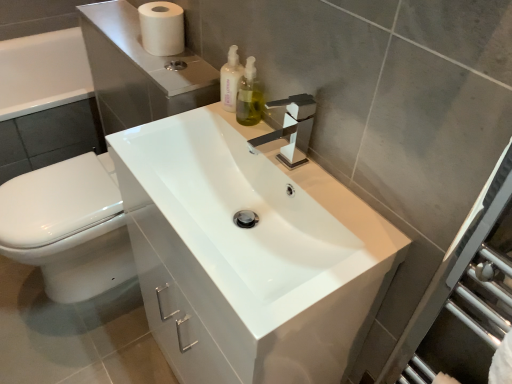
Where is `free point in front of white matte toilet paper at upper left`? free point in front of white matte toilet paper at upper left is located at coordinates (160, 68).